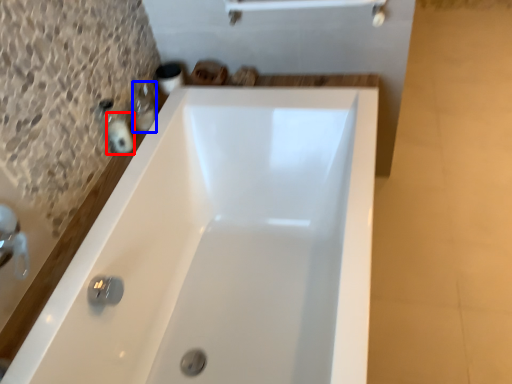
Question: Which of the following is the farthest to the observer, toiletry (highlighted by a red box) or toiletry (highlighted by a blue box)?

Choices:
 (A) toiletry
 (B) toiletry

Answer: (B)